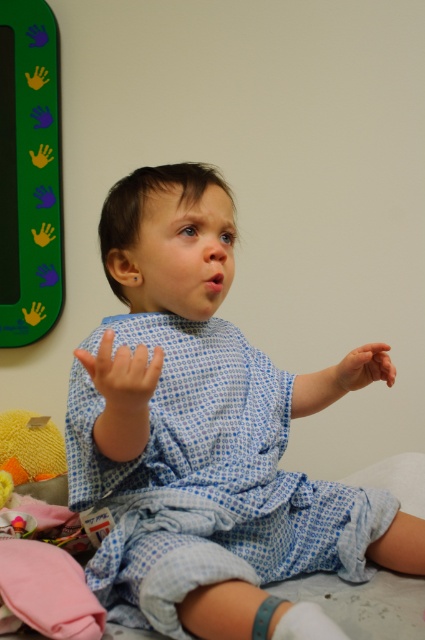
You are a nurse in a hospital. You need to place a small medical kit between the yellow fuzzy toy at lower left and the matte blue fabric hand at center. Can you fit it there?

The yellow fuzzy toy at lower left might be wider than matte blue fabric hand at center, so there might not be enough space to fit the medical kit between them.

Where is the blue checkered gown at center located in the image?

The blue checkered gown at center is located at point (206, 436).

What object is located at the coordinate point (206,436) in the image?

The point (206,436) corresponds to the blue checkered gown at center.